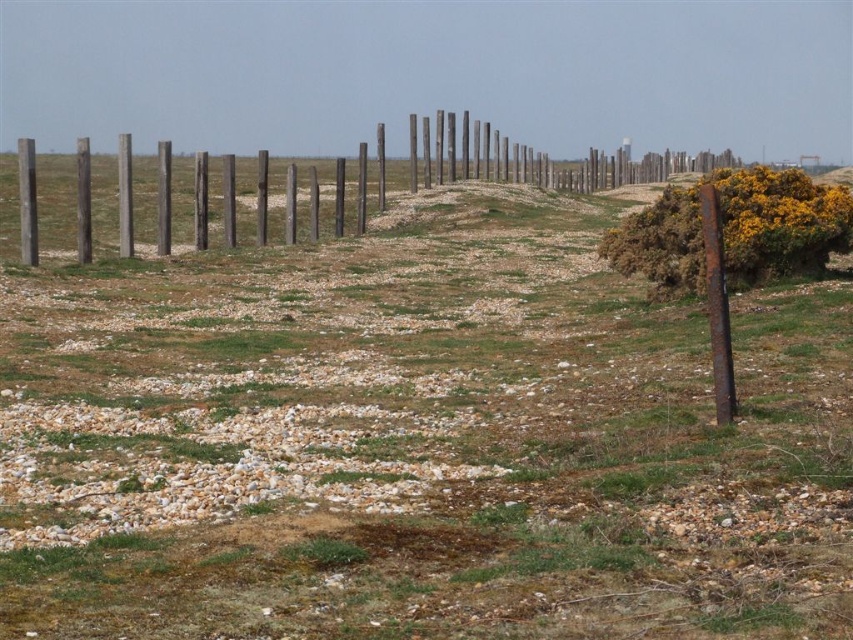
Looking at this image, you are standing at the point marked by the coordinates point (x=538, y=161) in the image. Looking around, you see weathered wood fence at center. Which direction should you walk to reach the yellow flowering bushes on the right side of the image?

Since the yellow flowering bushes are on the right side of the image, you should walk towards the right from the point (x=538, y=161) to reach them.

You are standing at the origin point in the image. Where is the weathered wood fence at center located in terms of coordinates?

The weathered wood fence at center is located at coordinates point (538, 161).

In the scene shown: You are a painter standing at the edge of the landscape and want to paint the weathered wood fence at center and the rusty metal post at right. Which object should you focus on first if you want to paint the taller one first?

The weathered wood fence at center is taller than the rusty metal post at right, so you should focus on painting the weathered wood fence at center first.